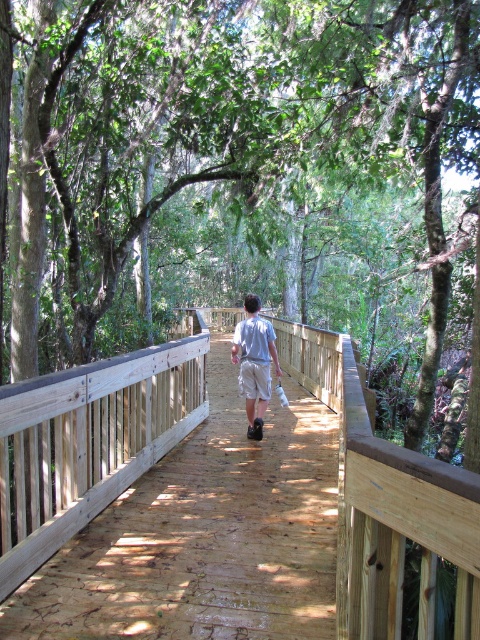
You are a hiker carrying a backpack and see the brown wooden bridge at center and the light gray cotton shirt at center in front of you. Which object is wider from your perspective?

The brown wooden bridge at center is wider than the light gray cotton shirt at center.

You are standing on the boardwalk and see the green leafy tree at center and the tan cotton shorts at center. Which object is located to the right of the other?

The tan cotton shorts at center is located to the right of the green leafy tree at center because the green leafy tree at center is positioned on the left side of tan cotton shorts at center.

You are a hiker walking on the boardwalk and you see the green leafy tree at center and the tan cotton shorts at center. Which object is bigger?

The green leafy tree at center is larger in size compared to the tan cotton shorts at center.